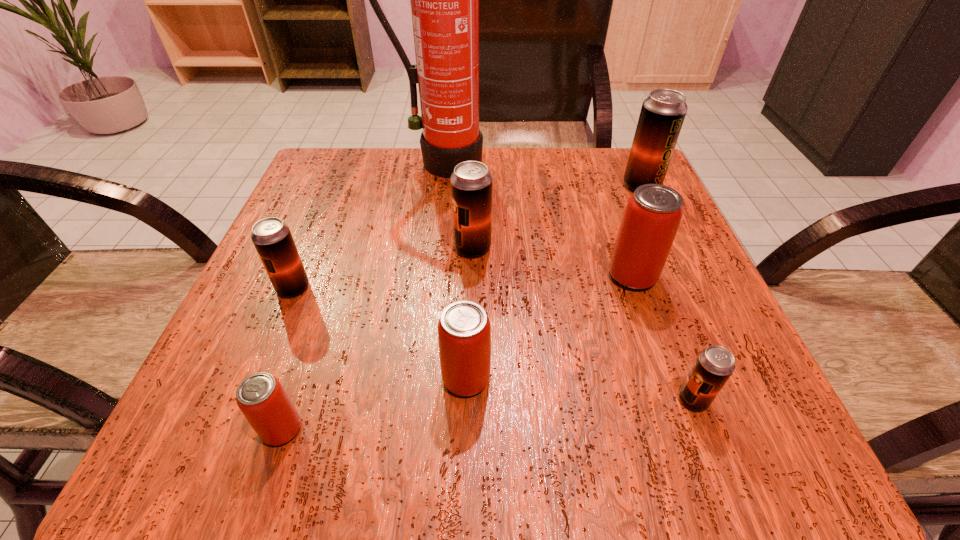
Identify the location of the tallest object. The width and height of the screenshot is (960, 540). (444, 0).

Where is `red fire extinguisher`? red fire extinguisher is located at coordinates (444, 0).

This screenshot has width=960, height=540. Identify the location of the tallest beer can. (663, 112).

Locate an element on the screen. The height and width of the screenshot is (540, 960). the rightmost object is located at coordinates (663, 112).

The width and height of the screenshot is (960, 540). Find the location of `the biggest pink beer can`. the biggest pink beer can is located at coordinates (653, 213).

Identify the location of the farthest pink beer can. This screenshot has width=960, height=540. (653, 213).

Find the location of a particular element. the third nearest black beer can is located at coordinates (471, 182).

This screenshot has width=960, height=540. What are the coordinates of `the third smallest black beer can` in the screenshot? It's located at (471, 182).

Locate an element on the screen. The image size is (960, 540). the second nearest black beer can is located at coordinates (272, 238).

This screenshot has height=540, width=960. What are the coordinates of `the leftmost object` in the screenshot? It's located at (272, 238).